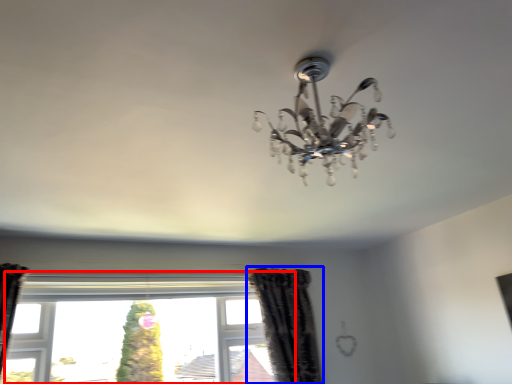
Question: Which object is further to the camera taking this photo, window (highlighted by a red box) or curtain (highlighted by a blue box)?

Choices:
 (A) window
 (B) curtain

Answer: (B)